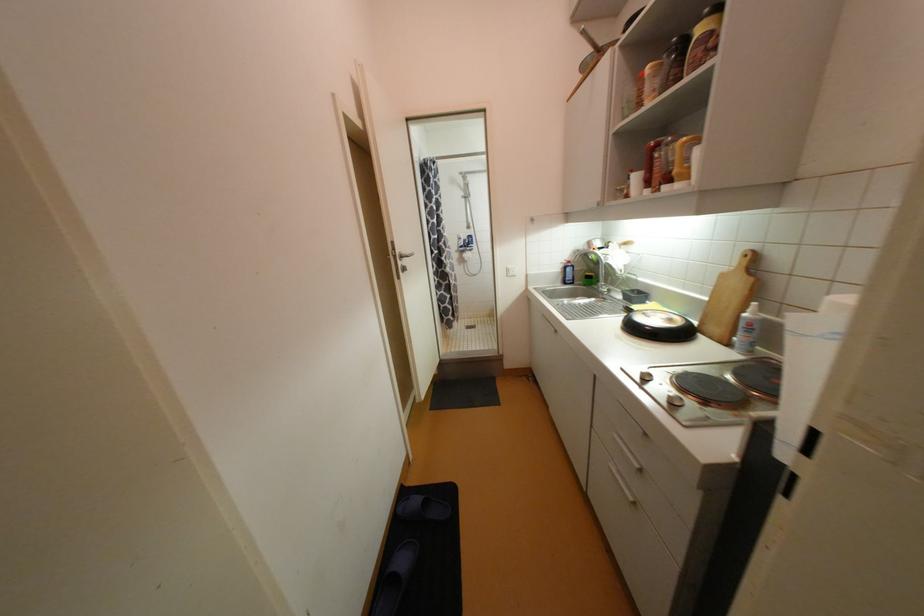
You are a GUI agent. You are given a task and a screenshot of the screen. Output one action in this format:
    pyautogui.click(x=<x>, y=<y>)
    Task: Click on the white spray bottle
    Image resolution: width=924 pixels, height=616 pixels.
    Given the screenshot: What is the action you would take?
    pyautogui.click(x=747, y=330)